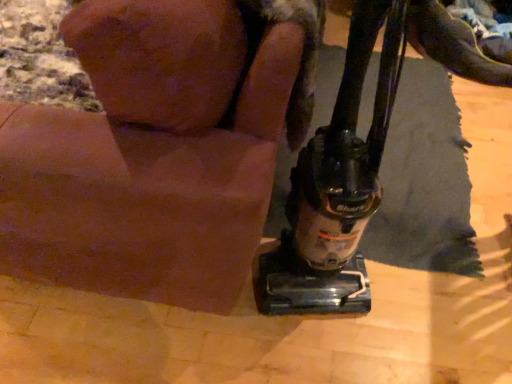
Question: Is black plastic vacuum cleaner at lower right not near black leather shoe at upper right?

Choices:
 (A) no
 (B) yes

Answer: (B)

Question: Is black plastic vacuum cleaner at lower right closer to camera compared to black leather shoe at upper right?

Choices:
 (A) no
 (B) yes

Answer: (B)

Question: From the image's perspective, is black plastic vacuum cleaner at lower right under black leather shoe at upper right?

Choices:
 (A) yes
 (B) no

Answer: (A)

Question: Is black plastic vacuum cleaner at lower right bigger than black leather shoe at upper right?

Choices:
 (A) no
 (B) yes

Answer: (B)

Question: Is black plastic vacuum cleaner at lower right outside black leather shoe at upper right?

Choices:
 (A) no
 (B) yes

Answer: (B)

Question: Is furry brown dog at lower right wider or thinner than black plastic vacuum cleaner at lower right?

Choices:
 (A) thin
 (B) wide

Answer: (B)

Question: In the image, is furry brown dog at lower right positioned in front of or behind black plastic vacuum cleaner at lower right?

Choices:
 (A) behind
 (B) front

Answer: (B)

Question: From a real-world perspective, is furry brown dog at lower right physically located above or below black plastic vacuum cleaner at lower right?

Choices:
 (A) below
 (B) above

Answer: (B)

Question: Considering the positions of point (287, 44) and point (374, 155), is point (287, 44) closer or farther from the camera than point (374, 155)?

Choices:
 (A) closer
 (B) farther

Answer: (A)

Question: In terms of width, does black plastic vacuum cleaner at lower right look wider or thinner when compared to furry brown dog at lower right?

Choices:
 (A) wide
 (B) thin

Answer: (B)

Question: Would you say black plastic vacuum cleaner at lower right is inside or outside furry brown dog at lower right?

Choices:
 (A) inside
 (B) outside

Answer: (A)

Question: From the image's perspective, relative to furry brown dog at lower right, is black plastic vacuum cleaner at lower right above or below?

Choices:
 (A) above
 (B) below

Answer: (B)

Question: Is black plastic vacuum cleaner at lower right taller or shorter than furry brown dog at lower right?

Choices:
 (A) tall
 (B) short

Answer: (A)

Question: From the image's perspective, relative to black leather shoe at upper right, is black plastic vacuum cleaner at lower right above or below?

Choices:
 (A) above
 (B) below

Answer: (B)

Question: From a real-world perspective, is black plastic vacuum cleaner at lower right physically located above or below black leather shoe at upper right?

Choices:
 (A) below
 (B) above

Answer: (B)